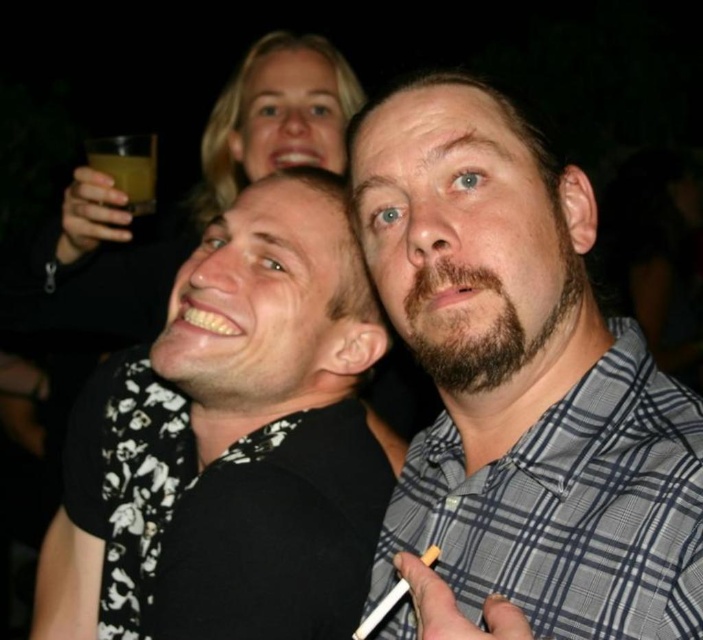
You are at a party and want to hand a drink to both the gray checkered shirt at center and the black floral shirt at center. Which one can you reach without stretching due to their height difference?

The gray checkered shirt at center has a lesser height compared to black floral shirt at center, so you can reach the gray checkered shirt at center without stretching.

You are a photographer at the event and want to capture both the gray checkered shirt at center and the black floral shirt at center in a single frame. Since your camera has a limited focus range, which shirt should you focus on to ensure both are in focus?

The gray checkered shirt at center is smaller than the black floral shirt at center. To ensure both are in focus, focus on the black floral shirt at center as it is larger and closer to the camera.

From the picture: You are standing in the middle of the room and want to find the black floral shirt at center. Which direction should you look to locate it?

The black floral shirt at center is located at point 0.694 on the x axis and 0.333 on the y axis. Since you are in the middle of the room, you should look to the right and slightly downward to find the black floral shirt at center.